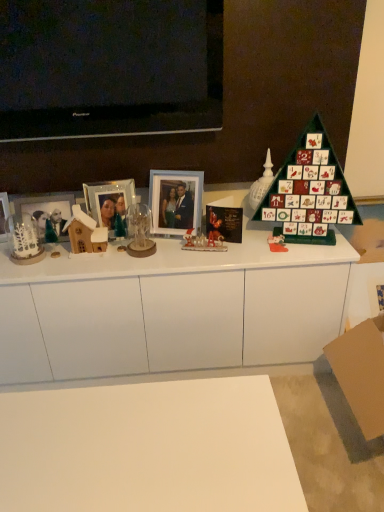
Locate an element on the screen. This screenshot has width=384, height=512. vacant space to the left of green matte advent calendar at right is located at coordinates (240, 250).